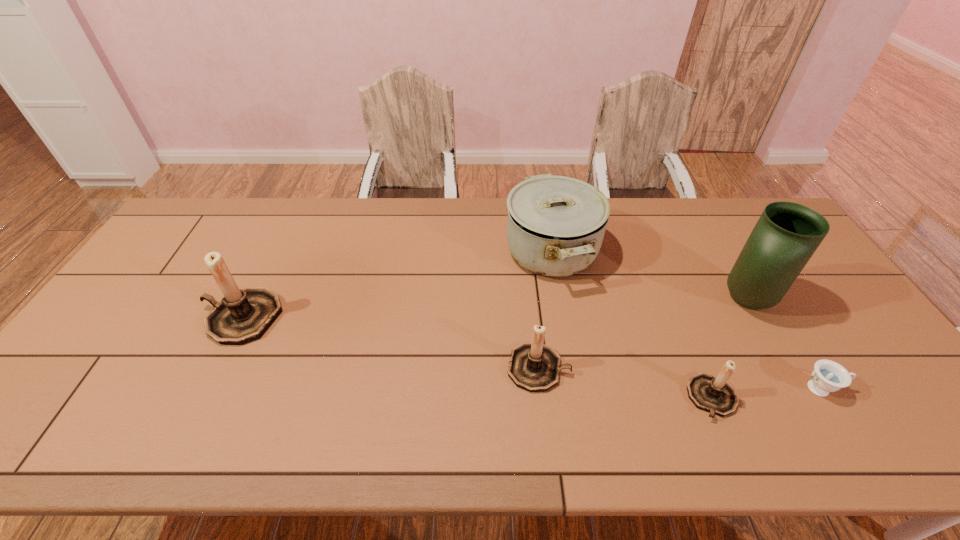
The height and width of the screenshot is (540, 960). Identify the location of the leftmost candle holder. (243, 315).

This screenshot has height=540, width=960. I want to click on the leftmost object, so click(x=243, y=315).

Identify the location of the second candle holder from left to right. This screenshot has height=540, width=960. (533, 366).

Where is `the fifth tallest object`? This screenshot has height=540, width=960. the fifth tallest object is located at coordinates (715, 395).

Where is `the third object from right to left`? The image size is (960, 540). the third object from right to left is located at coordinates 715,395.

Where is `saucepan`? Image resolution: width=960 pixels, height=540 pixels. saucepan is located at coordinates (556, 224).

Where is `teacup`? This screenshot has width=960, height=540. teacup is located at coordinates (828, 376).

The image size is (960, 540). I want to click on vase, so (x=787, y=234).

Locate an element on the screen. vacant region located on the left of the second tallest object is located at coordinates (129, 318).

At what (x,y) coordinates should I click in order to perform the action: click on vacant space located on the right of the second shortest candle holder. Please return your answer as a coordinate pair (x, y). Looking at the image, I should click on (606, 368).